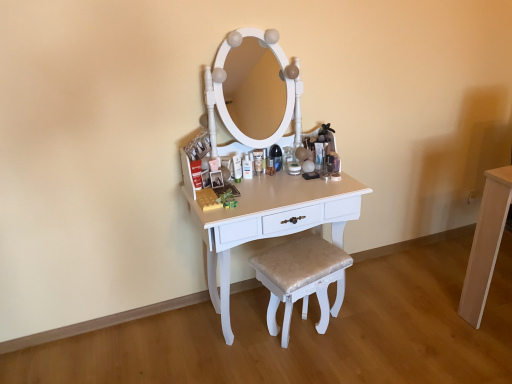
Locate an element on the screen. This screenshot has height=384, width=512. space that is in front of shiny beige cushioned stool at center is located at coordinates (316, 371).